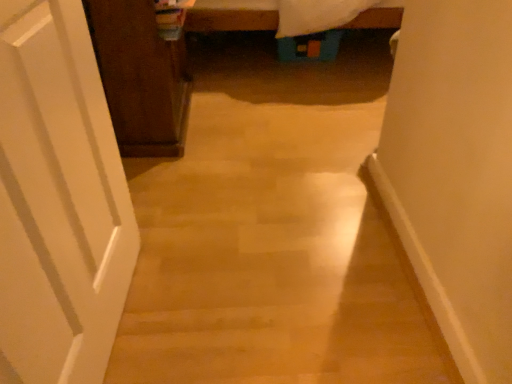
Question: Is white matte door at left smaller than dark wood cabinet at left?

Choices:
 (A) no
 (B) yes

Answer: (B)

Question: Is white matte door at left beside dark wood cabinet at left?

Choices:
 (A) yes
 (B) no

Answer: (B)

Question: Does white matte door at left lie in front of dark wood cabinet at left?

Choices:
 (A) yes
 (B) no

Answer: (A)

Question: From a real-world perspective, is white matte door at left on dark wood cabinet at left?

Choices:
 (A) yes
 (B) no

Answer: (A)

Question: Is white matte door at left not near dark wood cabinet at left?

Choices:
 (A) no
 (B) yes

Answer: (A)

Question: From the image's perspective, is white matte door at left below dark wood cabinet at left?

Choices:
 (A) no
 (B) yes

Answer: (B)

Question: From a real-world perspective, does dark wood cabinet at left stand above white matte door at left?

Choices:
 (A) yes
 (B) no

Answer: (B)

Question: Is dark wood cabinet at left beside white matte door at left?

Choices:
 (A) yes
 (B) no

Answer: (B)

Question: From the image's perspective, is dark wood cabinet at left on white matte door at left?

Choices:
 (A) yes
 (B) no

Answer: (A)

Question: Is dark wood cabinet at left shorter than white matte door at left?

Choices:
 (A) yes
 (B) no

Answer: (A)

Question: Is dark wood cabinet at left located outside white matte door at left?

Choices:
 (A) no
 (B) yes

Answer: (B)

Question: Is dark wood cabinet at left in front of white matte door at left?

Choices:
 (A) yes
 (B) no

Answer: (B)

Question: Is dark wood cabinet at left inside the boundaries of white matte door at left, or outside?

Choices:
 (A) outside
 (B) inside

Answer: (A)